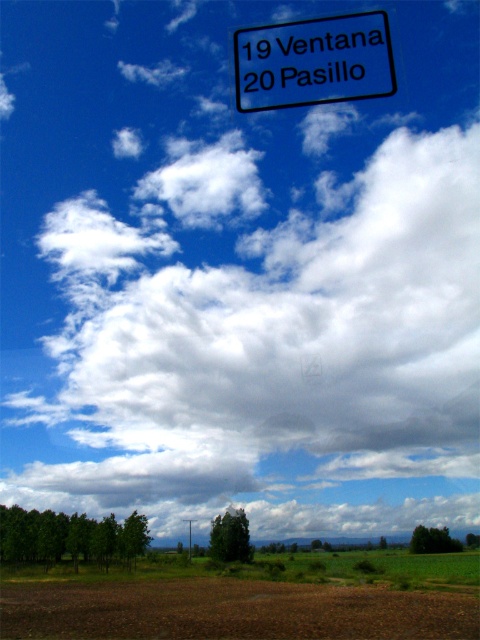
Question: Does black plastic sign at upper center have a smaller size compared to green leafy tree at lower right?

Choices:
 (A) no
 (B) yes

Answer: (B)

Question: Which of the following is the closest to the observer?

Choices:
 (A) green leafy tree at lower right
 (B) metallic pole at center
 (C) green matte trees at lower left
 (D) brown soil at lower center

Answer: (D)

Question: Is green leafy tree at center smaller than metallic pole at center?

Choices:
 (A) yes
 (B) no

Answer: (B)

Question: Which object appears closest to the camera in this image?

Choices:
 (A) green leafy tree at center
 (B) green leafy tree at lower right
 (C) green matte trees at lower left

Answer: (C)

Question: Which point appears farthest from the camera in this image?

Choices:
 (A) (12, 524)
 (B) (444, 538)

Answer: (B)

Question: Can you confirm if green matte trees at lower left is wider than green leafy tree at center?

Choices:
 (A) yes
 (B) no

Answer: (A)